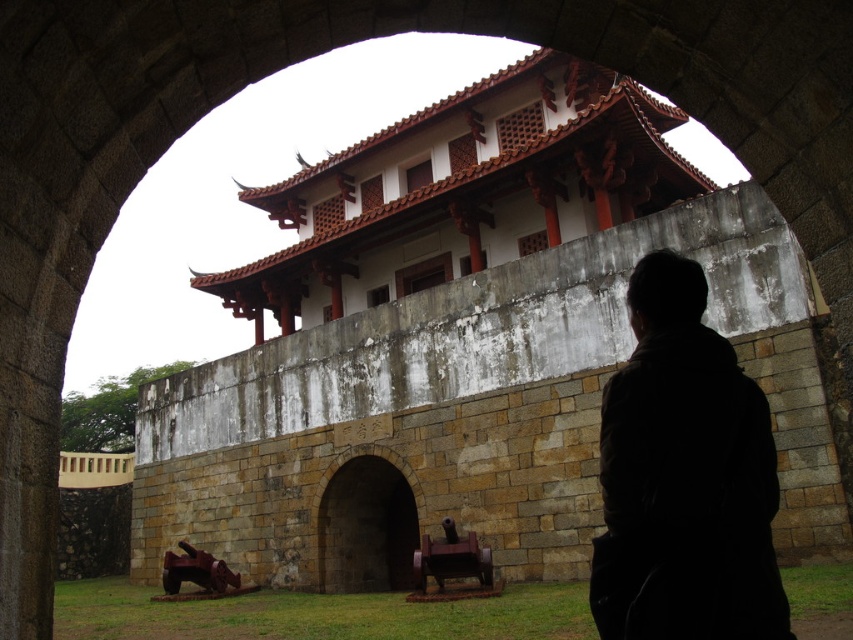
From the picture: Between black matte coat at lower right and brown stone archway at center, which one has less height?

brown stone archway at center is shorter.

Image resolution: width=853 pixels, height=640 pixels. I want to click on black matte coat at lower right, so click(683, 477).